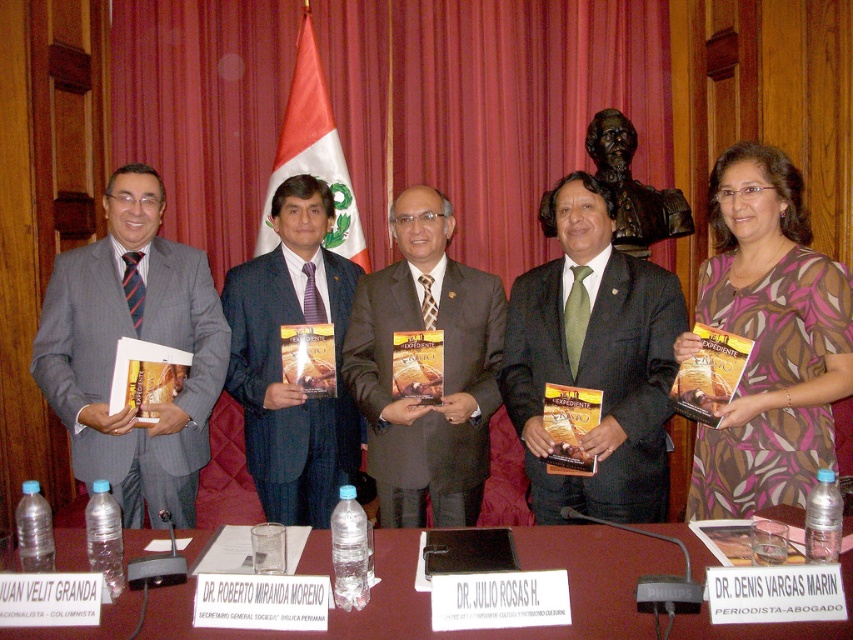
Can you confirm if gray pinstripe suit at left is positioned to the left of matte brown suit at center?

Yes, gray pinstripe suit at left is to the left of matte brown suit at center.

Between point (91, 451) and point (463, 368), which one is positioned in front?

Point (91, 451)

This screenshot has height=640, width=853. Find the location of `gray pinstripe suit at left`. gray pinstripe suit at left is located at coordinates (132, 337).

This screenshot has width=853, height=640. What do you see at coordinates (595, 358) in the screenshot?
I see `dark gray suit at center` at bounding box center [595, 358].

Is dark gray suit at center positioned at the back of maroon wood table at center?

That is True.

I want to click on dark gray suit at center, so click(595, 358).

Is patterned fabric dress at center to the right of maroon wood table at center from the viewer's perspective?

Indeed, patterned fabric dress at center is positioned on the right side of maroon wood table at center.

Is the position of patterned fabric dress at center less distant than that of maroon wood table at center?

No, it is not.

Is point (747, 260) less distant than point (428, 608)?

No, (747, 260) is behind (428, 608).

Where is `patterned fabric dress at center`? This screenshot has height=640, width=853. patterned fabric dress at center is located at coordinates (769, 339).